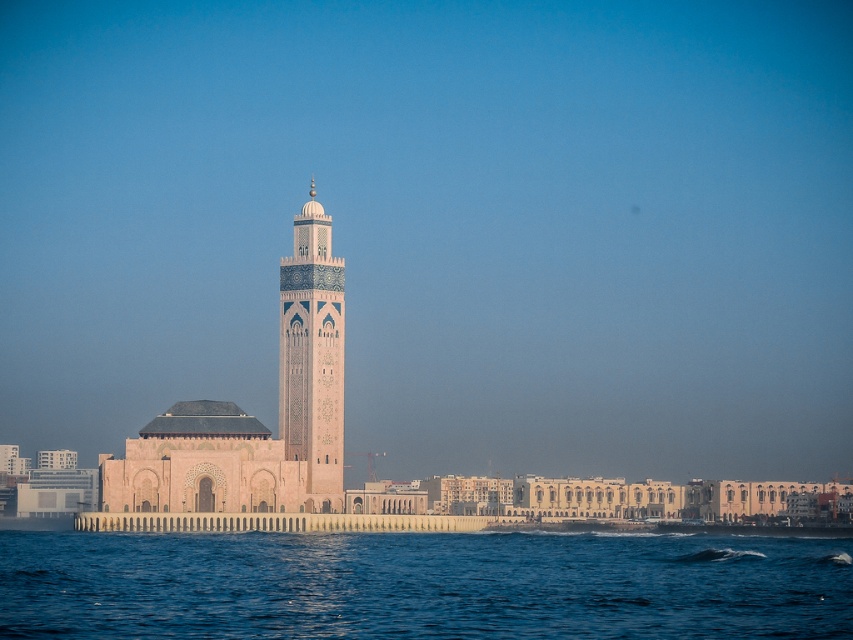
Who is lower down, blue water at lower center or pink stone minaret at center?

blue water at lower center is below.

Does blue water at lower center appear over pink stone minaret at center?

No.

This screenshot has width=853, height=640. Describe the element at coordinates (422, 586) in the screenshot. I see `blue water at lower center` at that location.

The width and height of the screenshot is (853, 640). What are the coordinates of `blue water at lower center` in the screenshot? It's located at (422, 586).